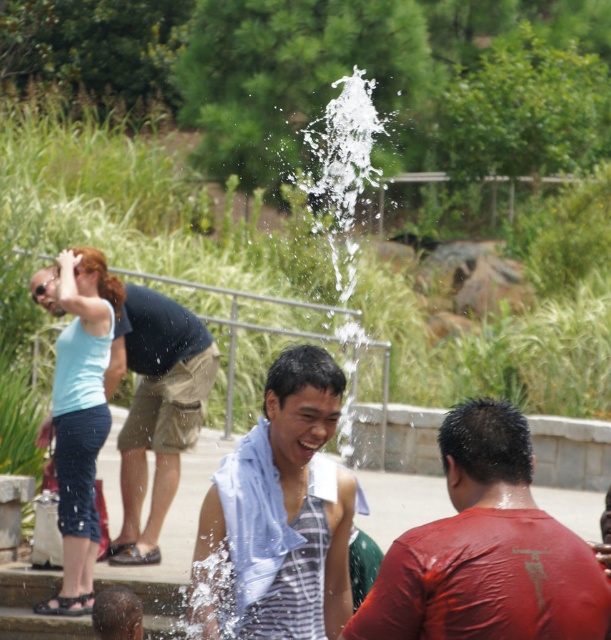
Between point (299, 497) and point (161, 353), which one is positioned behind?

Point (161, 353)

In the scene shown: Who is more forward, (315, 486) or (125, 493)?

Point (315, 486) is in front.

The height and width of the screenshot is (640, 611). Identify the location of striped sleeveless shirt at center. (285, 508).

Is matte red shirt at center wider than striped sleeveless shirt at center?

Yes.

Does matte red shirt at center appear under striped sleeveless shirt at center?

No, matte red shirt at center is not below striped sleeveless shirt at center.

Does point (514, 522) come behind point (284, 614)?

No, (514, 522) is in front of (284, 614).

The width and height of the screenshot is (611, 640). Find the location of `matte red shirt at center`. matte red shirt at center is located at coordinates (486, 550).

Does matte red shirt at center lie in front of matte black shirt at upper left?

Yes, it is.

Can you confirm if matte red shirt at center is positioned above matte black shirt at upper left?

Actually, matte red shirt at center is below matte black shirt at upper left.

Who is more forward, (502, 477) or (133, 333)?

Positioned in front is point (502, 477).

This screenshot has height=640, width=611. Find the location of `matte red shirt at center`. matte red shirt at center is located at coordinates (486, 550).